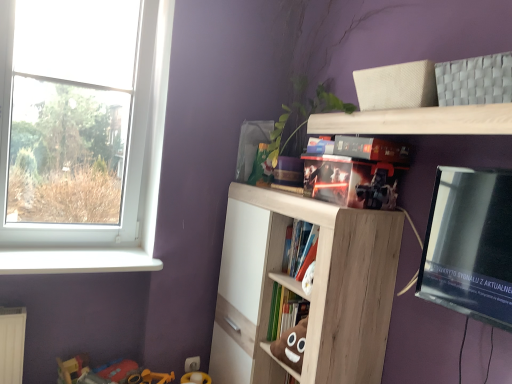
Question: Does white plastic window sill at lower left have a larger size compared to plastic toy at lower left?

Choices:
 (A) yes
 (B) no

Answer: (B)

Question: Is white plastic window sill at lower left positioned before plastic toy at lower left?

Choices:
 (A) yes
 (B) no

Answer: (A)

Question: Does white plastic window sill at lower left have a lesser height compared to plastic toy at lower left?

Choices:
 (A) yes
 (B) no

Answer: (A)

Question: Can you confirm if white plastic window sill at lower left is positioned to the left of plastic toy at lower left?

Choices:
 (A) no
 (B) yes

Answer: (B)

Question: Is white plastic window sill at lower left smaller than plastic toy at lower left?

Choices:
 (A) yes
 (B) no

Answer: (A)

Question: Relative to hardcover book at center, which is counted as the second book, starting from the bottom, is white plastic window sill at lower left in front or behind?

Choices:
 (A) behind
 (B) front

Answer: (A)

Question: In terms of width, does white plastic window sill at lower left look wider or thinner when compared to hardcover book at center, the second book positioned from the top?

Choices:
 (A) wide
 (B) thin

Answer: (A)

Question: Is white plastic window sill at lower left bigger or smaller than hardcover book at center, which is counted as the second book, starting from the bottom?

Choices:
 (A) big
 (B) small

Answer: (B)

Question: Considering the positions of point (120, 269) and point (287, 258), is point (120, 269) closer or farther from the camera than point (287, 258)?

Choices:
 (A) closer
 (B) farther

Answer: (B)

Question: In the image, is plastic toy at lower left positioned in front of or behind transparent glass window at left?

Choices:
 (A) behind
 (B) front

Answer: (B)

Question: Is plastic toy at lower left to the left or to the right of transparent glass window at left in the image?

Choices:
 (A) left
 (B) right

Answer: (B)

Question: Based on their sizes in the image, would you say plastic toy at lower left is bigger or smaller than transparent glass window at left?

Choices:
 (A) big
 (B) small

Answer: (B)

Question: Choose the correct answer: Is plastic toy at lower left inside transparent glass window at left or outside it?

Choices:
 (A) outside
 (B) inside

Answer: (A)

Question: Based on their positions, is black glossy tv at upper right located to the left or right of light wood shelf at upper center, the second shelf when ordered from bottom to top?

Choices:
 (A) right
 (B) left

Answer: (A)

Question: From a real-world perspective, is black glossy tv at upper right above or below light wood shelf at upper center, the second shelf when ordered from bottom to top?

Choices:
 (A) below
 (B) above

Answer: (A)